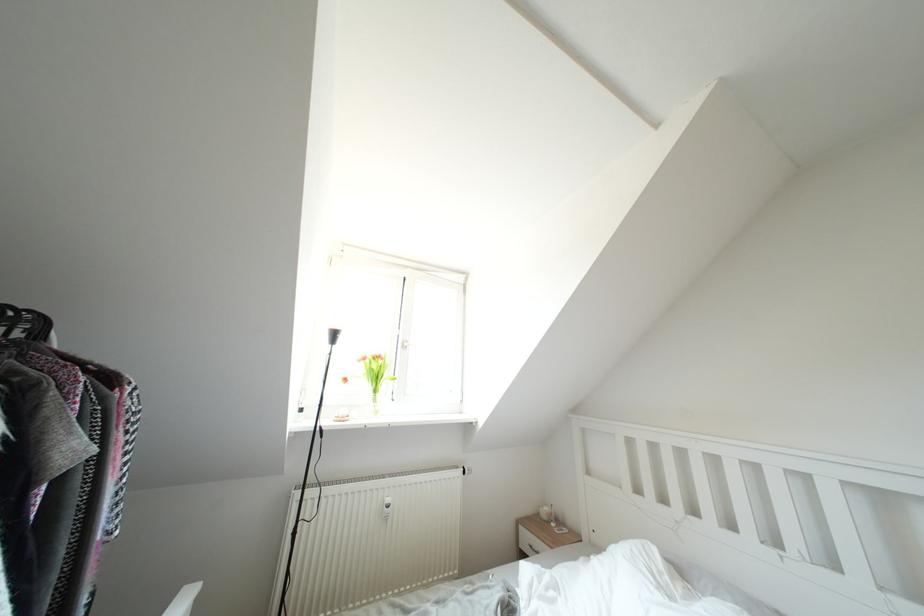
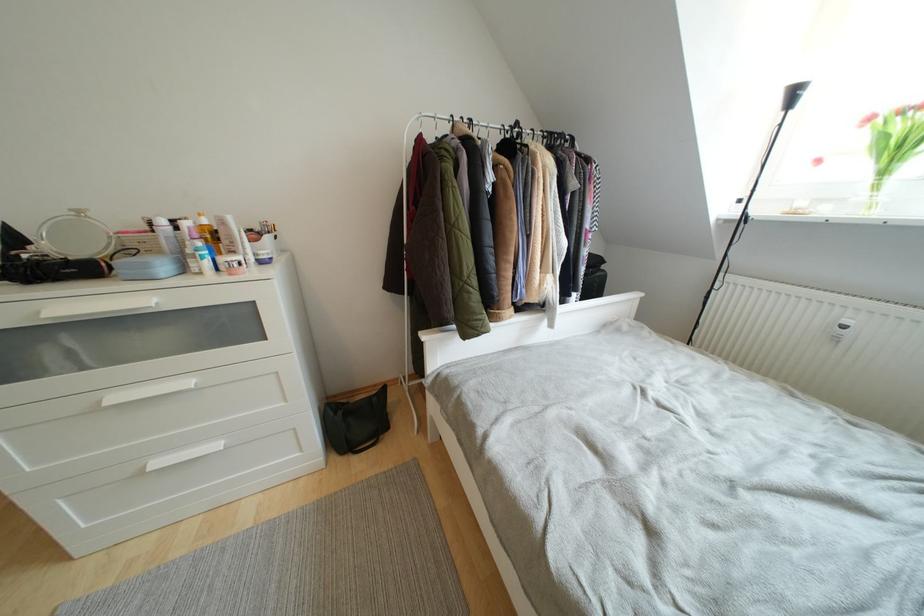
Where in the second image is the point corresponding to [381,395] from the first image?

(890, 176)